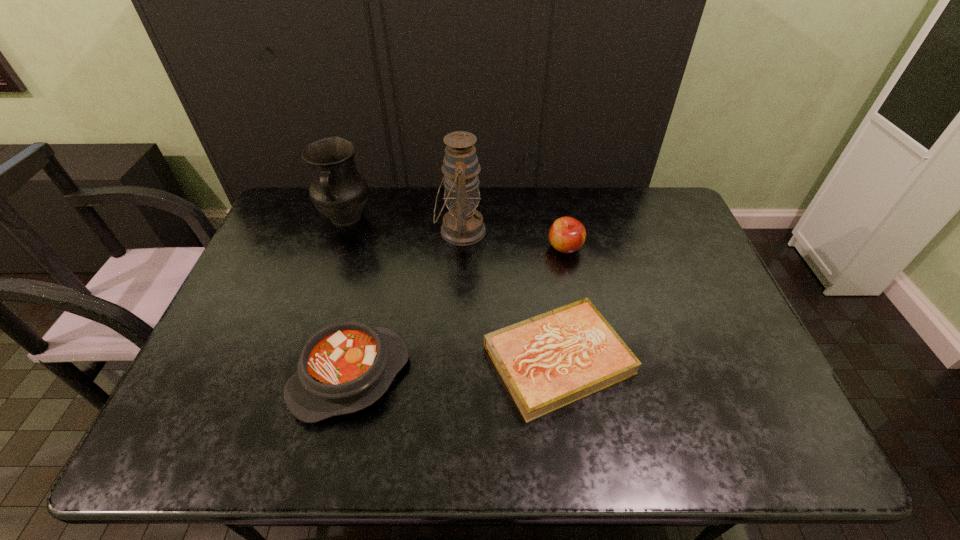
Select which object appears as the fourth closest to the shortest object. Please provide its 2D coordinates. Your answer should be formatted as a tuple, i.e. [(x, y)], where the tuple contains the x and y coordinates of a point satisfying the conditions above.

[(338, 190)]

Locate an element on the screen. The image size is (960, 540). object that stands as the closest to the casserole is located at coordinates (549, 361).

The width and height of the screenshot is (960, 540). Find the location of `free space that satisfies the following two spatial constraints: 1. on the handle side of the casserole; 2. on the left side of the fourth shortest object`. free space that satisfies the following two spatial constraints: 1. on the handle side of the casserole; 2. on the left side of the fourth shortest object is located at coordinates (293, 376).

The width and height of the screenshot is (960, 540). I want to click on vacant area in the image that satisfies the following two spatial constraints: 1. on the handle side of the hardback book; 2. on the right side of the pitcher, so click(x=299, y=360).

The image size is (960, 540). I want to click on free space in the image that satisfies the following two spatial constraints: 1. on the back side of the apple; 2. on the right side of the casserole, so click(380, 248).

Locate an element on the screen. This screenshot has height=540, width=960. vacant space that satisfies the following two spatial constraints: 1. on the handle side of the apple; 2. on the left side of the pitcher is located at coordinates click(x=336, y=248).

Locate an element on the screen. Image resolution: width=960 pixels, height=540 pixels. vacant point that satisfies the following two spatial constraints: 1. on the handle side of the second tallest object; 2. on the right side of the casserole is located at coordinates (293, 376).

The width and height of the screenshot is (960, 540). What are the coordinates of `vacant space that satisfies the following two spatial constraints: 1. on the handle side of the casserole; 2. on the right side of the fourth shortest object` in the screenshot? It's located at (293, 376).

Identify the location of free space that satisfies the following two spatial constraints: 1. on the back side of the casserole; 2. on the left side of the tallest object. (384, 231).